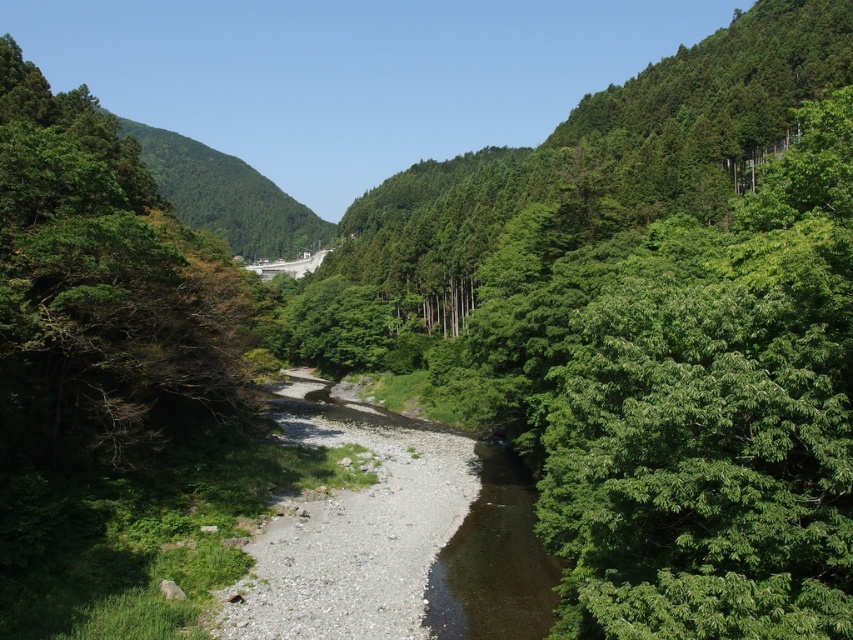
Question: Is green leafy tree at center to the left of green leafy tree at left from the viewer's perspective?

Choices:
 (A) no
 (B) yes

Answer: (A)

Question: Does green leafy tree at center appear on the left side of green leafy tree at left?

Choices:
 (A) no
 (B) yes

Answer: (A)

Question: Which point is farther to the camera?

Choices:
 (A) (270, 220)
 (B) (805, 540)
 (C) (10, 301)

Answer: (A)

Question: Is green leafy tree at center positioned behind green forested hillside at center?

Choices:
 (A) yes
 (B) no

Answer: (B)

Question: Among these points, which one is nearest to the camera?

Choices:
 (A) (296, 237)
 (B) (601, 140)
 (C) (158, 220)

Answer: (C)

Question: Which is farther from the green leafy tree at left?

Choices:
 (A) green forested hillside at center
 (B) green leafy tree at center

Answer: (A)